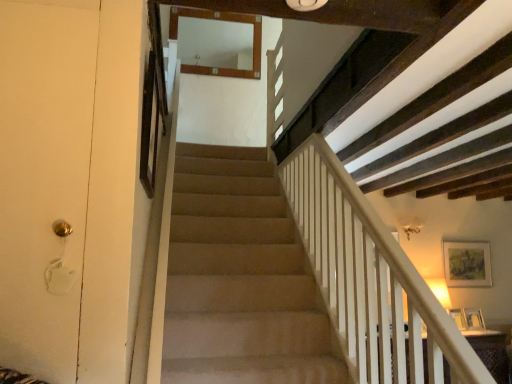
This screenshot has width=512, height=384. What do you see at coordinates (44, 176) in the screenshot?
I see `white matte door at left` at bounding box center [44, 176].

Identify the location of white matte door at left. (44, 176).

Locate an element on the screen. white matte door at left is located at coordinates (44, 176).